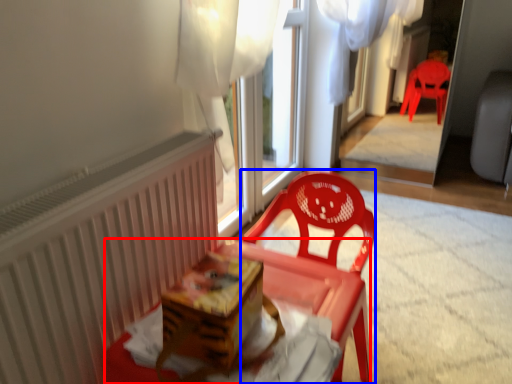
Question: Which of the following is the farthest to the observer, table (highlighted by a red box) or chair (highlighted by a blue box)?

Choices:
 (A) table
 (B) chair

Answer: (B)